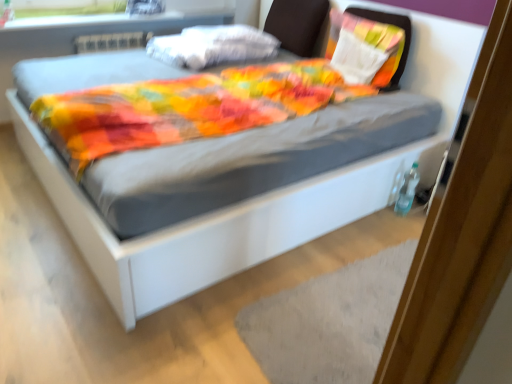
Question: Is gray textured mat at lower center shorter than brown fabric headboard at upper center?

Choices:
 (A) no
 (B) yes

Answer: (B)

Question: Is there a large distance between gray textured mat at lower center and brown fabric headboard at upper center?

Choices:
 (A) no
 (B) yes

Answer: (B)

Question: Does gray textured mat at lower center have a lesser width compared to brown fabric headboard at upper center?

Choices:
 (A) yes
 (B) no

Answer: (B)

Question: Is gray textured mat at lower center turned away from brown fabric headboard at upper center?

Choices:
 (A) no
 (B) yes

Answer: (A)

Question: Can you confirm if gray textured mat at lower center is positioned to the left of brown fabric headboard at upper center?

Choices:
 (A) no
 (B) yes

Answer: (A)

Question: In terms of size, does textured fabric pillow at upper right, marked as the second pillow in a left-to-right arrangement, appear bigger or smaller than matte plastic window sill at upper left?

Choices:
 (A) big
 (B) small

Answer: (A)

Question: Considering their positions, is textured fabric pillow at upper right, arranged as the 1th pillow when viewed from the right, located in front of or behind matte plastic window sill at upper left?

Choices:
 (A) behind
 (B) front

Answer: (B)

Question: Is point (372, 16) closer or farther from the camera than point (170, 14)?

Choices:
 (A) farther
 (B) closer

Answer: (B)

Question: Visually, is textured fabric pillow at upper right, marked as the second pillow in a left-to-right arrangement, positioned to the left or to the right of matte plastic window sill at upper left?

Choices:
 (A) left
 (B) right

Answer: (B)

Question: From the image's perspective, is textured fabric pillow at upper right, arranged as the 1th pillow when viewed from the right, located above or below gray textured mat at lower center?

Choices:
 (A) below
 (B) above

Answer: (B)

Question: Does point (330, 57) appear closer or farther from the camera than point (379, 264)?

Choices:
 (A) closer
 (B) farther

Answer: (B)

Question: Is textured fabric pillow at upper right, marked as the second pillow in a left-to-right arrangement, in front of or behind gray textured mat at lower center in the image?

Choices:
 (A) front
 (B) behind

Answer: (B)

Question: In the image, is textured fabric pillow at upper right, arranged as the 1th pillow when viewed from the right, on the left side or the right side of gray textured mat at lower center?

Choices:
 (A) right
 (B) left

Answer: (A)

Question: Looking at their shapes, would you say gray textured mat at lower center is wider or thinner than textured fabric pillow at upper right, arranged as the 1th pillow when viewed from the right?

Choices:
 (A) thin
 (B) wide

Answer: (B)

Question: From a real-world perspective, relative to textured fabric pillow at upper right, arranged as the 1th pillow when viewed from the right, is gray textured mat at lower center vertically above or below?

Choices:
 (A) above
 (B) below

Answer: (B)